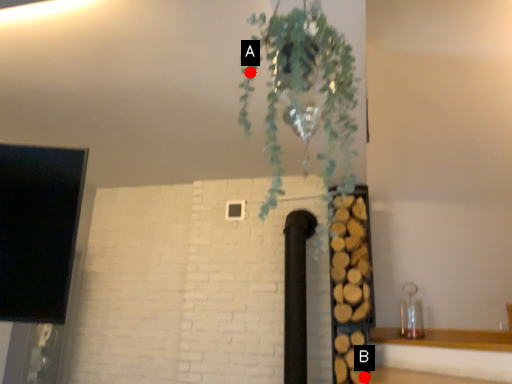
Question: Two points are circled on the image, labeled by A and B beside each circle. Which of the following is the farthest from the observer?

Choices:
 (A) A is further
 (B) B is further

Answer: (B)